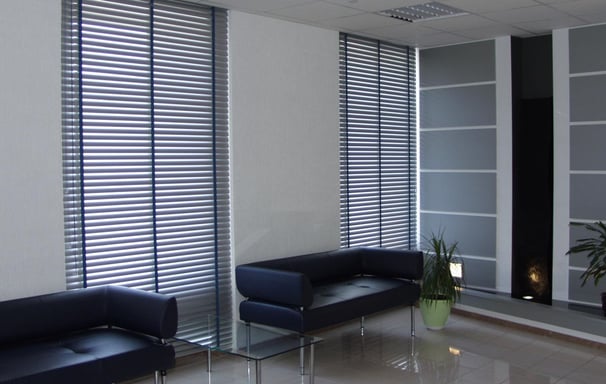
You are a GUI agent. You are given a task and a screenshot of the screen. Output one action in this format:
    pyautogui.click(x=<x>, y=<y>)
    Task: Click on the plant
    
    Given the screenshot: What is the action you would take?
    pyautogui.click(x=442, y=270)